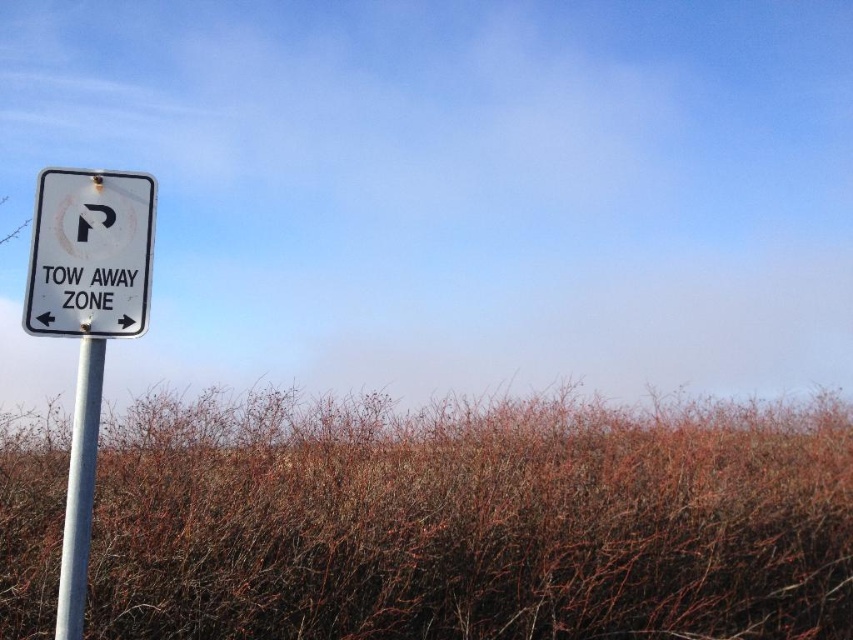
You are a delivery driver who needs to park your vehicle near the white metallic sign at left and the metallic pole at left. The parking space between them is narrow. Can you safely park your vehicle here if your vehicle is 6 feet wide?

The distance between the white metallic sign at left and the metallic pole at left is 7.70 inches, which is much narrower than your 6 feet wide vehicle. Therefore, you cannot safely park your vehicle in this space.

Looking at this image, you are a delivery driver who needs to park your vehicle temporarily. You see the white metallic sign at left and brown dry grass at left in the image. Based on the scene, which object is closer to the ground?

The brown dry grass at left is positioned under the white metallic sign at left, so it is closer to the ground.

You are standing in front of the Tow Away Zone sign and want to touch both the white plastic sign at upper left and the metallic pole at left. Which object will you reach first?

You will reach the white plastic sign at upper left first because it is closer to you than the metallic pole at left, which is further away.